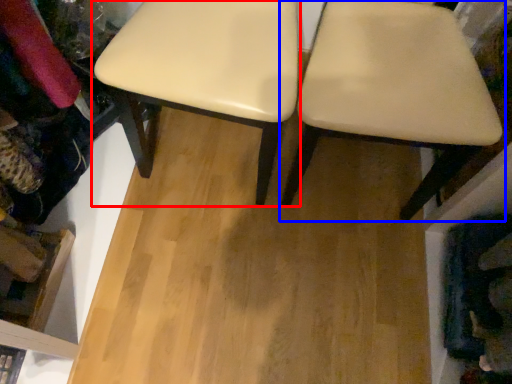
Question: Which object appears farthest to the camera in this image, stool (highlighted by a red box) or chair (highlighted by a blue box)?

Choices:
 (A) stool
 (B) chair

Answer: (A)